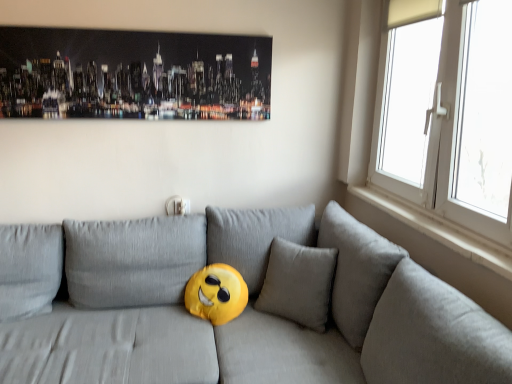
Question: Would you say white smooth window sill at right contains white plastic window at right?

Choices:
 (A) yes
 (B) no

Answer: (B)

Question: Is white smooth window sill at right not within white plastic window at right?

Choices:
 (A) yes
 (B) no

Answer: (B)

Question: From the image's perspective, is white smooth window sill at right over white plastic window at right?

Choices:
 (A) yes
 (B) no

Answer: (B)

Question: Is white plastic window at right at the back of white smooth window sill at right?

Choices:
 (A) no
 (B) yes

Answer: (B)

Question: From the image's perspective, is white smooth window sill at right beneath white plastic window at right?

Choices:
 (A) no
 (B) yes

Answer: (B)

Question: Can you see white smooth window sill at right touching white plastic window at right?

Choices:
 (A) yes
 (B) no

Answer: (B)

Question: Is white plastic window at right behind metallic cityscape art at upper center?

Choices:
 (A) no
 (B) yes

Answer: (A)

Question: Is white plastic window at right smaller than metallic cityscape art at upper center?

Choices:
 (A) no
 (B) yes

Answer: (A)

Question: Are white plastic window at right and metallic cityscape art at upper center beside each other?

Choices:
 (A) no
 (B) yes

Answer: (A)

Question: Does white plastic window at right have a greater width compared to metallic cityscape art at upper center?

Choices:
 (A) no
 (B) yes

Answer: (B)

Question: Can you confirm if white plastic window at right is thinner than metallic cityscape art at upper center?

Choices:
 (A) yes
 (B) no

Answer: (B)

Question: Considering the relative sizes of white plastic window at right and metallic cityscape art at upper center in the image provided, is white plastic window at right shorter than metallic cityscape art at upper center?

Choices:
 (A) no
 (B) yes

Answer: (A)

Question: Could white plastic window at right be considered to be inside metallic cityscape art at upper center?

Choices:
 (A) yes
 (B) no

Answer: (B)